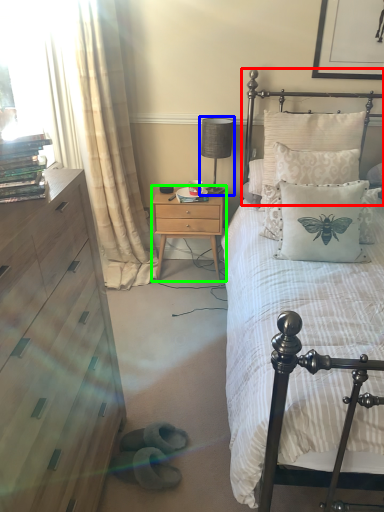
Question: Which object is the farthest from headboard (highlighted by a red box)? Choose among these: table lamp (highlighted by a blue box) or nightstand (highlighted by a green box).

Choices:
 (A) table lamp
 (B) nightstand

Answer: (B)